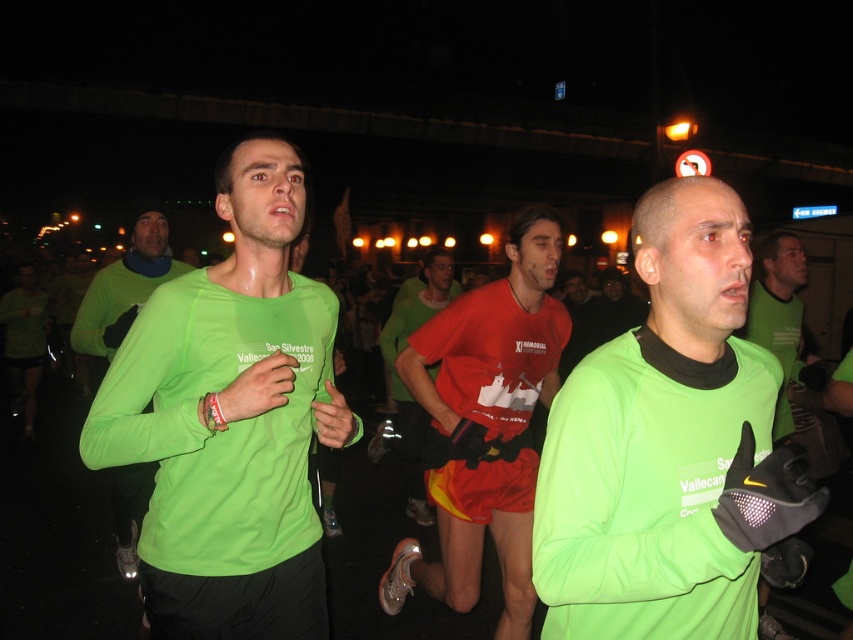
Question: Which of the following is the farthest from the observer?

Choices:
 (A) (525, 284)
 (B) (10, 310)

Answer: (B)

Question: Does matte red shirt at center have a lesser width compared to matte green long-sleeve shirt at center?

Choices:
 (A) no
 (B) yes

Answer: (A)

Question: Estimate the real-world distances between objects in this image. Which object is farther from the neon green long-sleeve shirt at center?

Choices:
 (A) green matte long-sleeve shirt at left
 (B) matte red shirt at center
 (C) green matte long-sleeve shirt at center

Answer: (A)

Question: Does neon green long-sleeve shirt at center appear under red matte shorts at center?

Choices:
 (A) no
 (B) yes

Answer: (A)

Question: Which object is the farthest from the neon green long-sleeve shirt at center?

Choices:
 (A) matte green long-sleeve shirt at center
 (B) matte red shirt at center

Answer: (A)

Question: Does neon green long-sleeve shirt at center appear on the left side of matte red shirt at center?

Choices:
 (A) no
 (B) yes

Answer: (B)